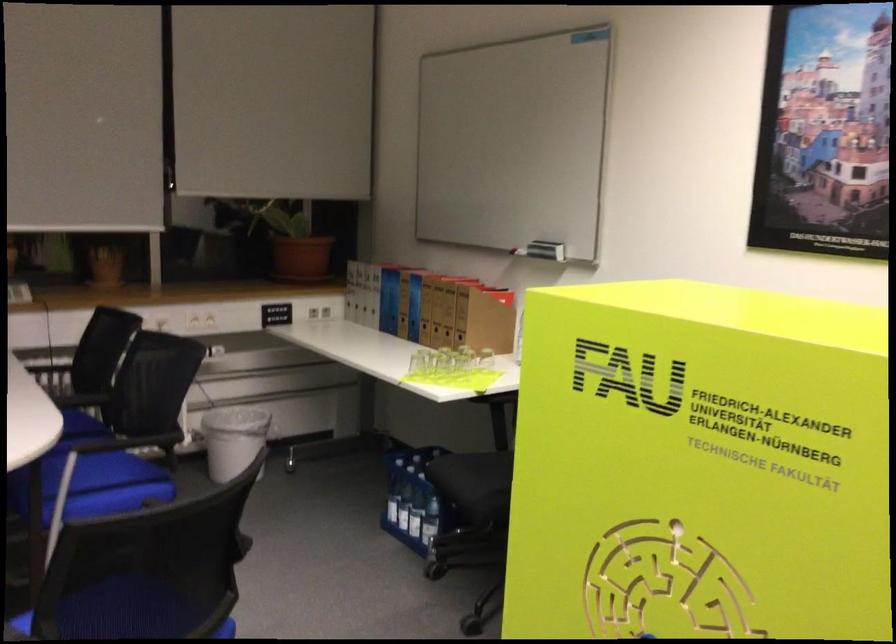
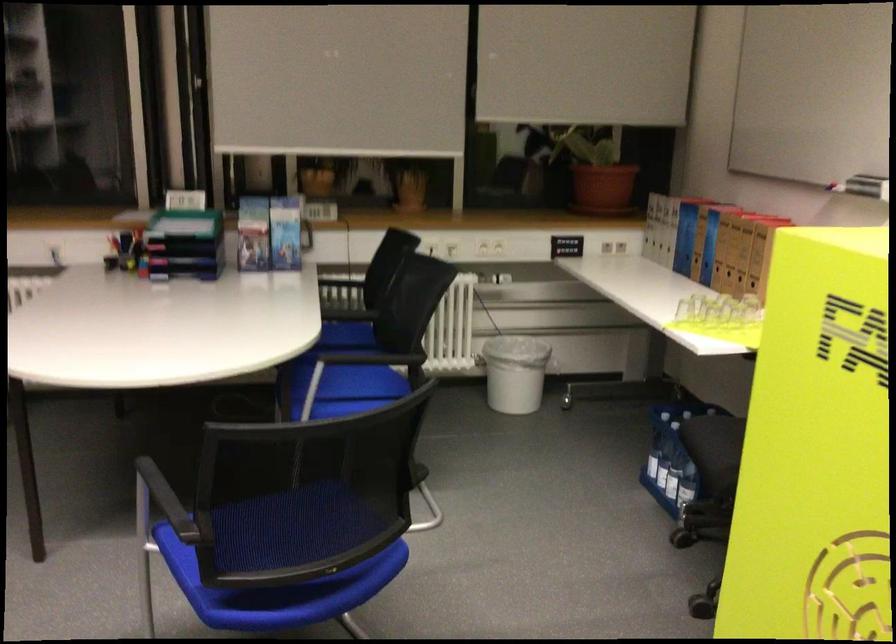
Where in the second image is the point corresponding to point 451,304 from the first image?

(746, 243)